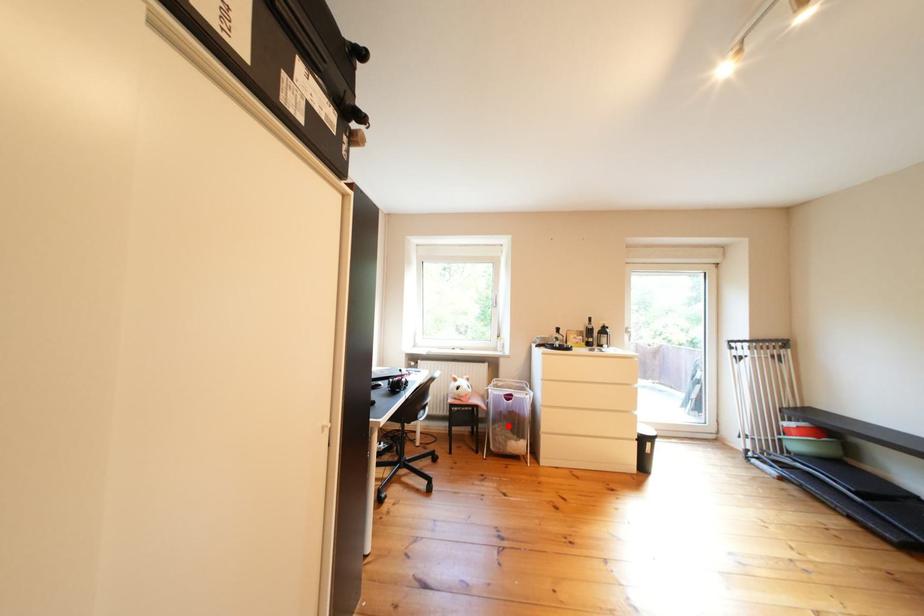
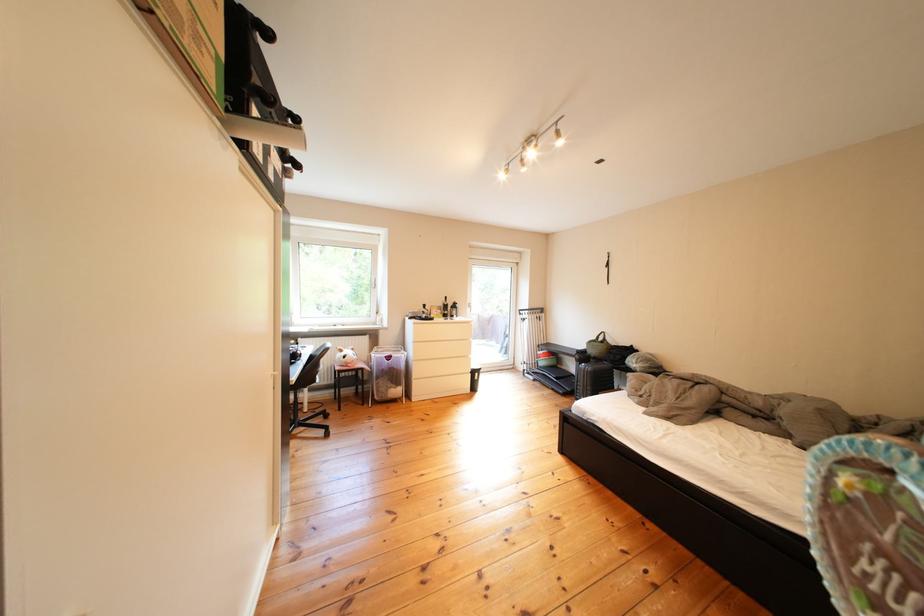
Where in the second image is the point corresponding to the highlighted location from the first image?

(392, 382)